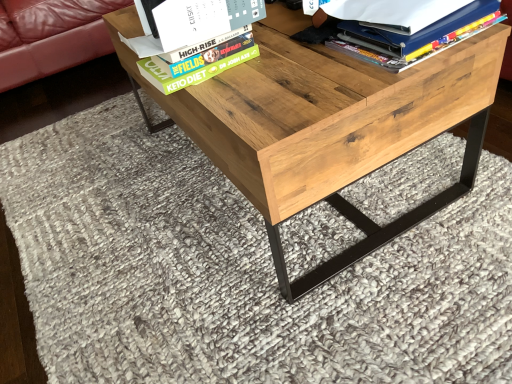
The width and height of the screenshot is (512, 384). I want to click on vacant space that is to the left of natural wood table at center, so click(100, 201).